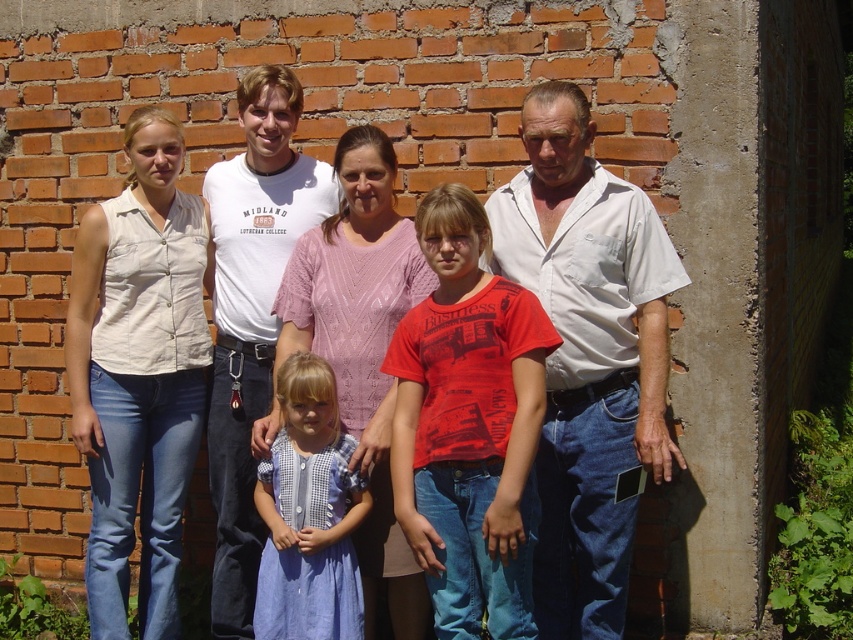
Between white cotton shirt at right and matte red t-shirt at center, which one is positioned lower?

matte red t-shirt at center is below.

Is point (657, 420) in front of point (498, 380)?

No, (657, 420) is behind (498, 380).

What are the coordinates of `white cotton shirt at right` in the screenshot? It's located at (587, 355).

The height and width of the screenshot is (640, 853). I want to click on white cotton shirt at right, so pyautogui.click(x=587, y=355).

Who is more distant from viewer, (495, 566) or (308, 445)?

Positioned behind is point (308, 445).

Between matte red t-shirt at center and blue cotton dress at center, which one is positioned lower?

blue cotton dress at center is lower down.

Is point (480, 604) positioned after point (280, 513)?

No, (480, 604) is in front of (280, 513).

Locate an element on the screen. The width and height of the screenshot is (853, 640). matte red t-shirt at center is located at coordinates (468, 426).

Is white cotton shirt at right smaller than blue cotton dress at center?

Actually, white cotton shirt at right might be larger than blue cotton dress at center.

Describe the element at coordinates (587, 355) in the screenshot. I see `white cotton shirt at right` at that location.

At what (x,y) coordinates should I click in order to perform the action: click on white cotton shirt at right. Please return your answer as a coordinate pair (x, y). Looking at the image, I should click on (587, 355).